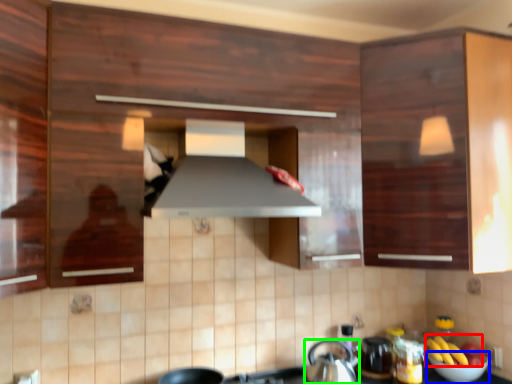
Question: Which is nearer to the banana (highlighted by a red box)? bowl (highlighted by a blue box) or kitchen appliance (highlighted by a green box).

Choices:
 (A) bowl
 (B) kitchen appliance

Answer: (A)